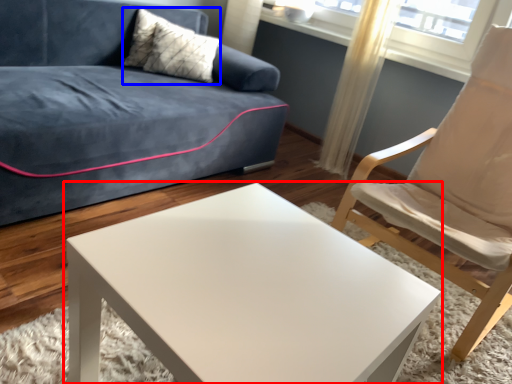
Question: Which object appears farthest to the camera in this image, coffee table (highlighted by a red box) or pillow (highlighted by a blue box)?

Choices:
 (A) coffee table
 (B) pillow

Answer: (B)